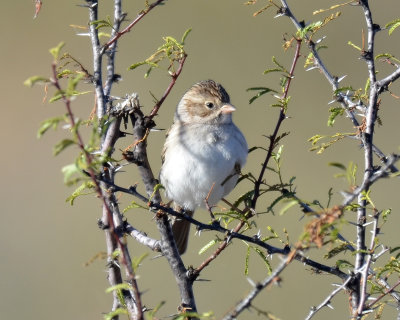
Where is `white chest`? The image size is (400, 320). white chest is located at coordinates (203, 166).